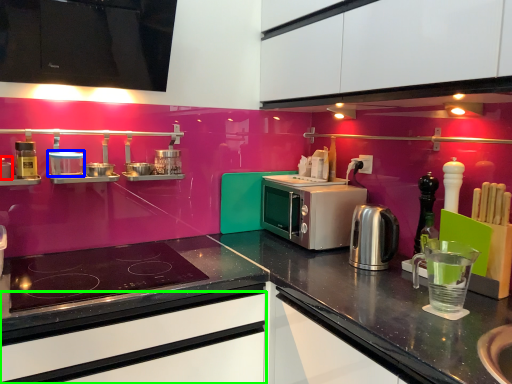
Question: Which is farther away from appliance (highlighted by a red box)? appliance (highlighted by a blue box) or drawer (highlighted by a green box)?

Choices:
 (A) appliance
 (B) drawer

Answer: (B)